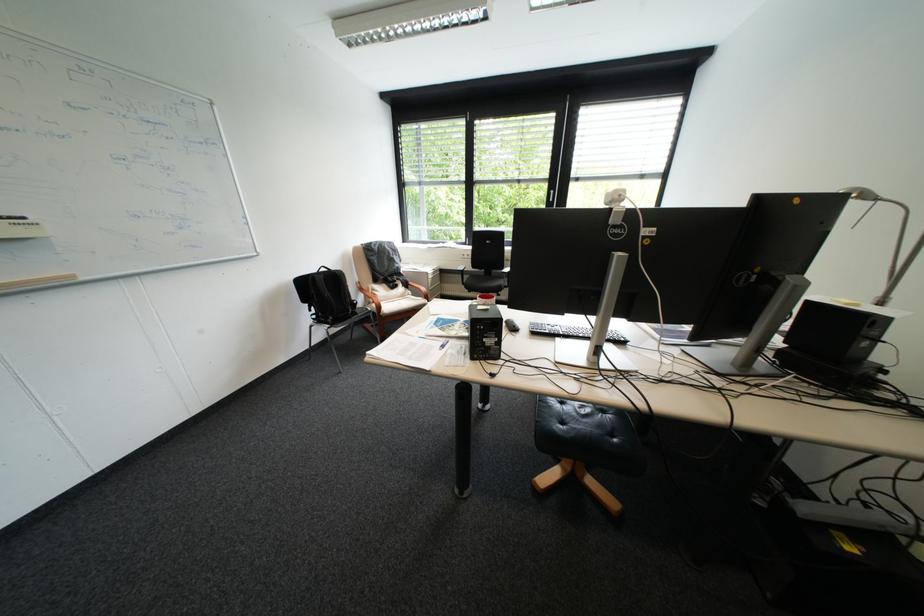
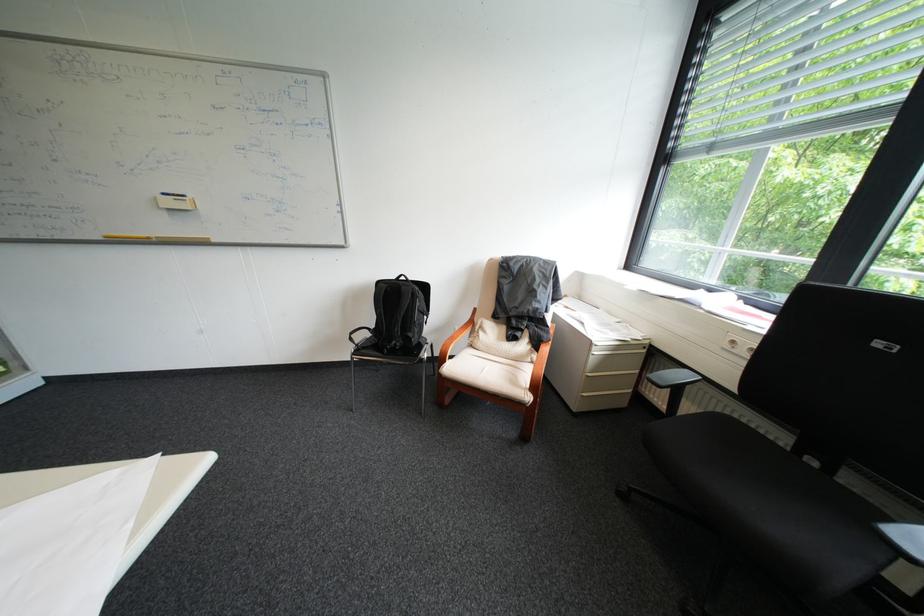
Locate, in the second image, the point that corresponds to point 476,254 in the first image.

(746, 342)